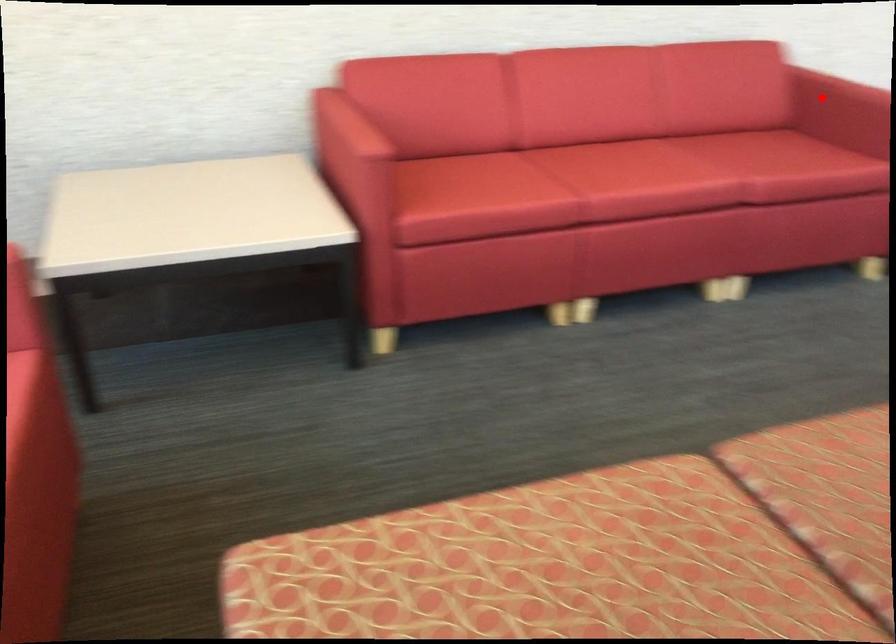
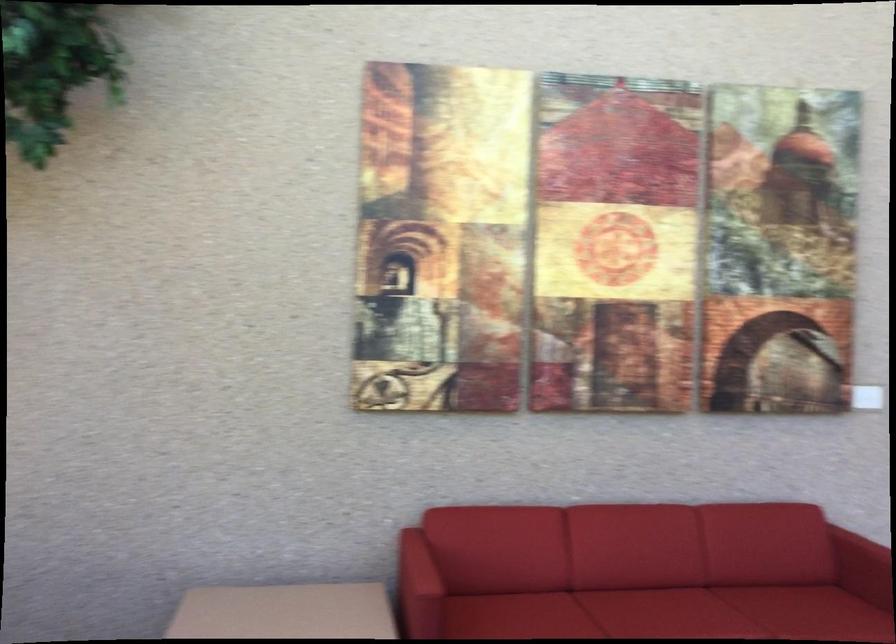
Find the pixel in the second image that matches the highlighted location in the first image.

(864, 558)